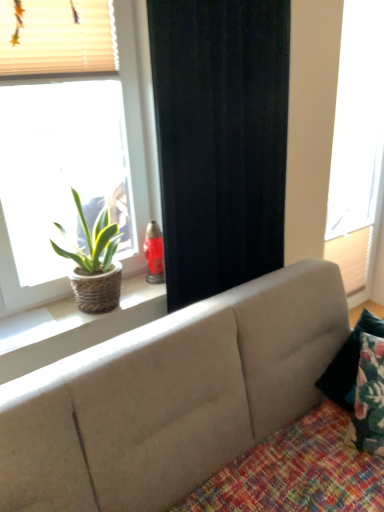
Question: Is beige fabric blinds at upper left oriented towards matte wicker basket at left, the 2th window viewed from the back?

Choices:
 (A) no
 (B) yes

Answer: (B)

Question: Is matte wicker basket at left, arranged as the first window when viewed from the left, at the back of beige fabric blinds at upper left?

Choices:
 (A) yes
 (B) no

Answer: (B)

Question: Does beige fabric blinds at upper left have a lesser height compared to matte wicker basket at left, the 1th window in the front-to-back sequence?

Choices:
 (A) yes
 (B) no

Answer: (A)

Question: Can you confirm if beige fabric blinds at upper left is thinner than matte wicker basket at left, the 1th window in the front-to-back sequence?

Choices:
 (A) no
 (B) yes

Answer: (A)

Question: Does beige fabric blinds at upper left lie in front of matte wicker basket at left, arranged as the first window when viewed from the left?

Choices:
 (A) no
 (B) yes

Answer: (A)

Question: Does point (344, 1) appear closer or farther from the camera than point (119, 18)?

Choices:
 (A) closer
 (B) farther

Answer: (B)

Question: Is white matte window at right, arranged as the 2th window when viewed from the front, wider or thinner than matte wicker basket at left, which is counted as the 2th window, starting from the right?

Choices:
 (A) wide
 (B) thin

Answer: (B)

Question: In terms of height, does white matte window at right, placed as the 1th window when sorted from right to left, look taller or shorter compared to matte wicker basket at left, which is counted as the 2th window, starting from the right?

Choices:
 (A) short
 (B) tall

Answer: (B)

Question: Visually, is white matte window at right, placed as the 1th window when sorted from right to left, positioned to the left or to the right of matte wicker basket at left, the 2th window viewed from the back?

Choices:
 (A) right
 (B) left

Answer: (A)

Question: From the image's perspective, relative to matte wicker basket at left, the 2th window viewed from the back, is black fabric curtain at center above or below?

Choices:
 (A) below
 (B) above

Answer: (B)

Question: In the image, is black fabric curtain at center on the left side or the right side of matte wicker basket at left, which is counted as the 2th window, starting from the right?

Choices:
 (A) left
 (B) right

Answer: (B)

Question: In the image, is black fabric curtain at center positioned in front of or behind matte wicker basket at left, which is counted as the 2th window, starting from the right?

Choices:
 (A) behind
 (B) front

Answer: (A)

Question: Is black fabric curtain at center situated inside matte wicker basket at left, the 2th window viewed from the back, or outside?

Choices:
 (A) outside
 (B) inside

Answer: (A)

Question: Is multicolored woven quilt at lower right to the left or to the right of beige fabric blinds at upper left in the image?

Choices:
 (A) left
 (B) right

Answer: (B)

Question: Is multicolored woven quilt at lower right inside or outside of beige fabric blinds at upper left?

Choices:
 (A) outside
 (B) inside

Answer: (A)